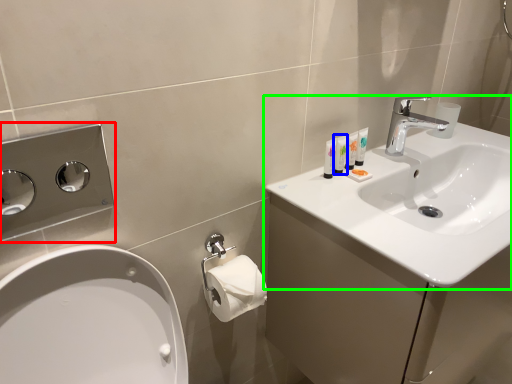
Question: Which is nearer to the hand dryer (highlighted by a red box)? mouthwash (highlighted by a blue box) or sink (highlighted by a green box).

Choices:
 (A) mouthwash
 (B) sink

Answer: (B)